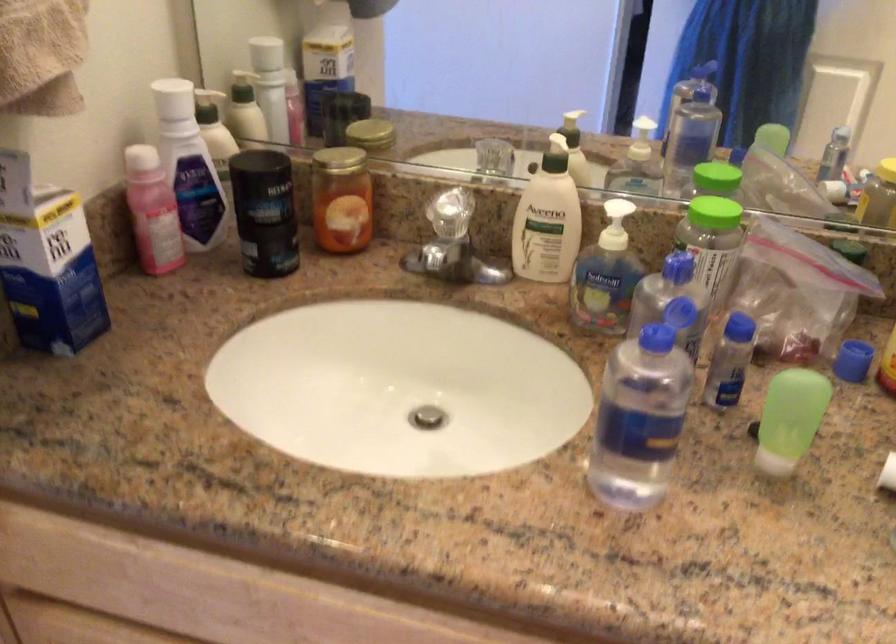
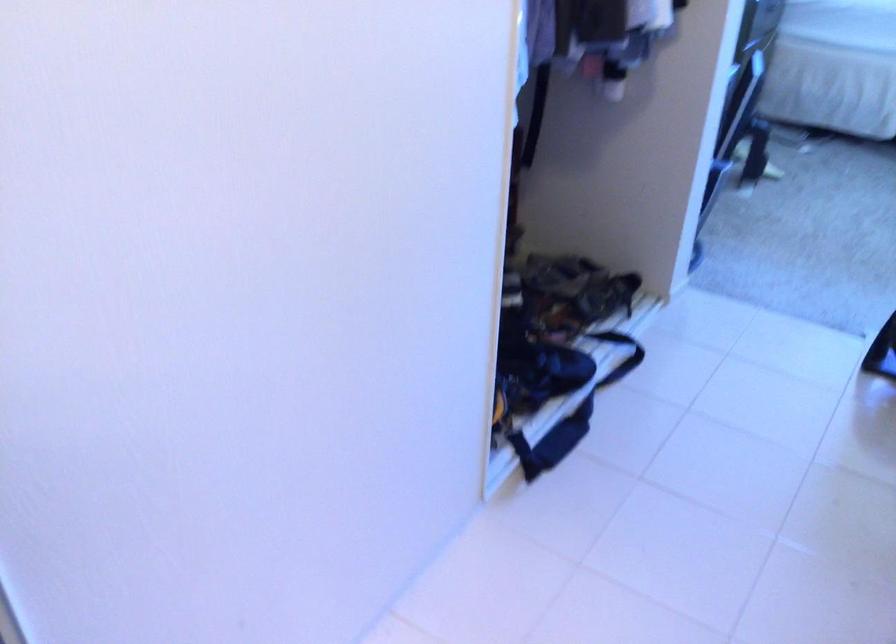
The images are taken continuously from a first-person perspective. In which direction is your viewpoint rotating?

The rotation direction of the camera is left-down.